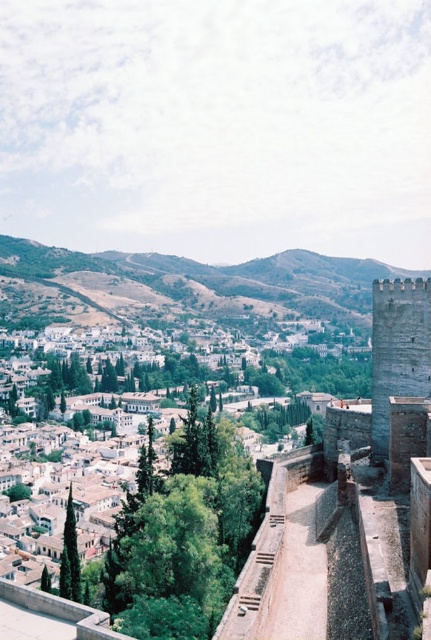
You are standing on the stone wall and looking out. Which object is closer to you between the white stone town at center and the green grassy hillside at center?

The white stone town at center is closer to you than the green grassy hillside at center because it is positioned in front of it.

In the scene shown: You are a tourist standing at the stone wall with a crenellated parapet. You want to take a photo that includes both the white stone town at center and the gray stone tower at right. Which object will appear wider in the photo?

The white stone town at center will appear wider in the photo because its width is larger than the gray stone tower at right.